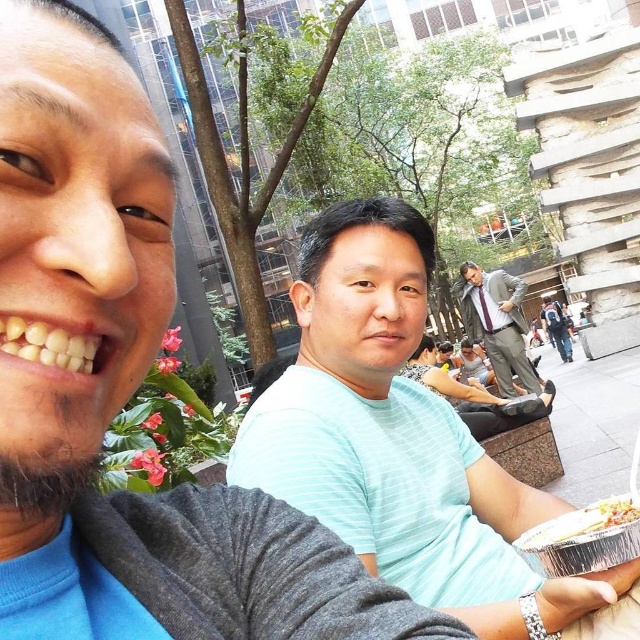
You are a photographer trying to capture a group photo of the light blue striped shirt at center and the gray suit at center. Which person should you position closer to the camera to ensure both appear equally sized in the photo?

The gray suit at center is smaller than the light blue striped shirt at center. To make them appear equal in size, position the gray suit at center closer to the camera since it is smaller and needs to be magnified more to match the size of the light blue striped shirt at center.

You are a photographer trying to capture both the gray suit at center and the silver foil tray at lower right in a single frame. Given their sizes, which object will appear bigger in the photo?

The gray suit at center will appear bigger in the photo because it is larger in size than the silver foil tray at lower right.